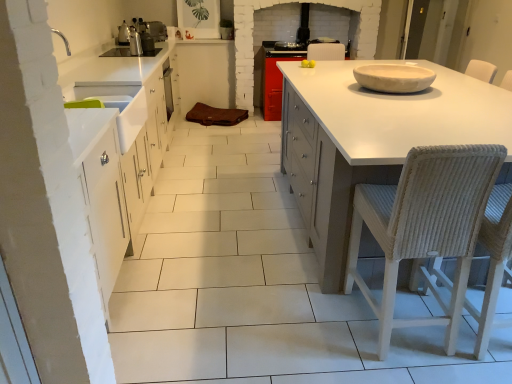
Image resolution: width=512 pixels, height=384 pixels. I want to click on free space above white matte countertop at center (from a real-world perspective), so click(x=402, y=99).